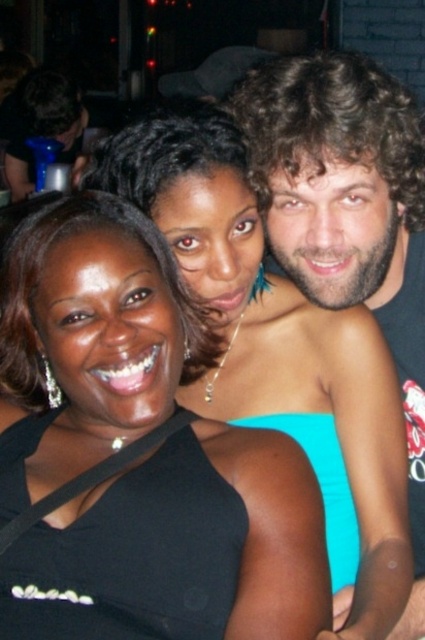
Who is positioned more to the right, matte black dress at center or teal fabric dress at center?

teal fabric dress at center is more to the right.

Is matte black dress at center taller than teal fabric dress at center?

Correct, matte black dress at center is much taller as teal fabric dress at center.

Is point (118, 444) more distant than point (357, 524)?

No.

Identify the location of matte black dress at center. (135, 454).

At what (x,y) coordinates should I click in order to perform the action: click on matte black dress at center. Please return your answer as a coordinate pair (x, y). Image resolution: width=425 pixels, height=640 pixels. Looking at the image, I should click on (135, 454).

Does matte black dress at center appear under curly hair at upper right?

Indeed, matte black dress at center is positioned under curly hair at upper right.

Which is behind, point (51, 632) or point (288, 232)?

Positioned behind is point (288, 232).

Find the location of a particular element. matte black dress at center is located at coordinates (135, 454).

From the picture: Is curly hair at upper right to the left of black satin dress at lower left from the viewer's perspective?

Incorrect, curly hair at upper right is not on the left side of black satin dress at lower left.

Does curly hair at upper right have a greater width compared to black satin dress at lower left?

Indeed, curly hair at upper right has a greater width compared to black satin dress at lower left.

Does point (295, 120) come farther from viewer compared to point (192, 572)?

Yes, point (295, 120) is farther from viewer.

Where is `curly hair at upper right`? curly hair at upper right is located at coordinates (348, 216).